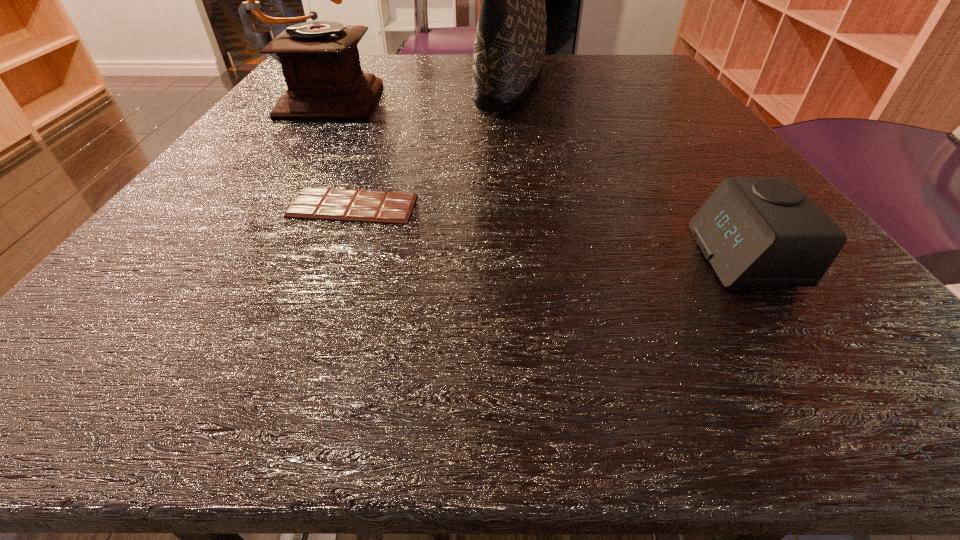
Identify the location of free space located on the front-facing side of the alarm clock. (641, 256).

Where is `free space located 0.100m on the front-facing side of the alarm clock`? This screenshot has width=960, height=540. free space located 0.100m on the front-facing side of the alarm clock is located at coordinates (615, 256).

This screenshot has height=540, width=960. What are the coordinates of `vacant position located 0.230m on the front of the chocolate bar` in the screenshot? It's located at point(287,383).

The image size is (960, 540). Find the location of `tote bag at the far edge`. tote bag at the far edge is located at coordinates (510, 41).

This screenshot has height=540, width=960. I want to click on phonograph record that is at the far edge, so click(x=320, y=61).

I want to click on phonograph record that is at the left edge, so click(x=320, y=61).

I want to click on chocolate bar positioned at the left edge, so click(x=312, y=203).

Where is `object at the right edge`? The image size is (960, 540). object at the right edge is located at coordinates (755, 231).

Locate an element on the screen. object positioned at the far left corner is located at coordinates (320, 61).

This screenshot has width=960, height=540. What are the coordinates of `vacant space at the far edge` in the screenshot? It's located at (404, 53).